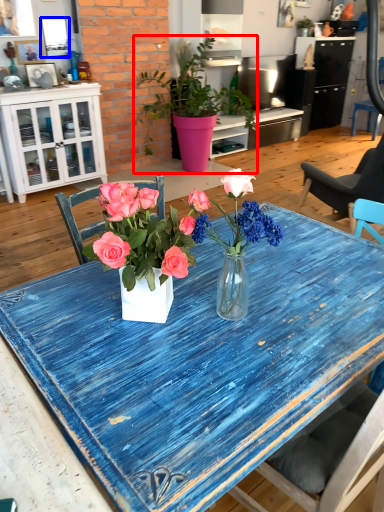
Question: Among these objects, which one is nearest to the camera, houseplant (highlighted by a red box) or picture frame (highlighted by a blue box)?

Choices:
 (A) houseplant
 (B) picture frame

Answer: (A)